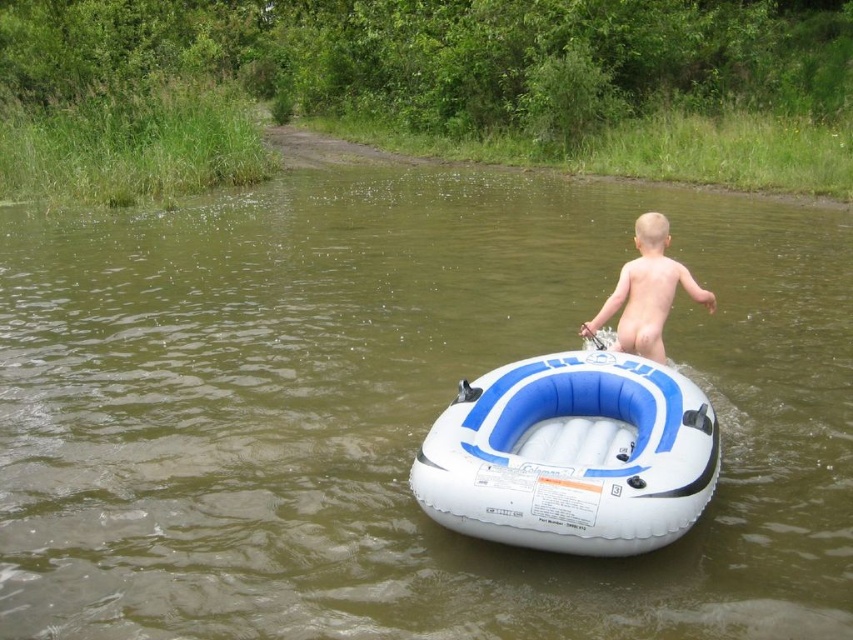
Question: Is white inflatable boat at center thinner than naked skin boy at center?

Choices:
 (A) yes
 (B) no

Answer: (B)

Question: Does white inflatable boat at center have a larger size compared to naked skin boy at center?

Choices:
 (A) yes
 (B) no

Answer: (A)

Question: Among these objects, which one is nearest to the camera?

Choices:
 (A) naked skin boy at center
 (B) white inflatable boat at center

Answer: (B)

Question: In this image, where is white inflatable boat at center located relative to naked skin boy at center?

Choices:
 (A) below
 (B) above

Answer: (A)

Question: Which of the following is the closest to the observer?

Choices:
 (A) white inflatable boat at center
 (B) naked skin boy at center

Answer: (A)